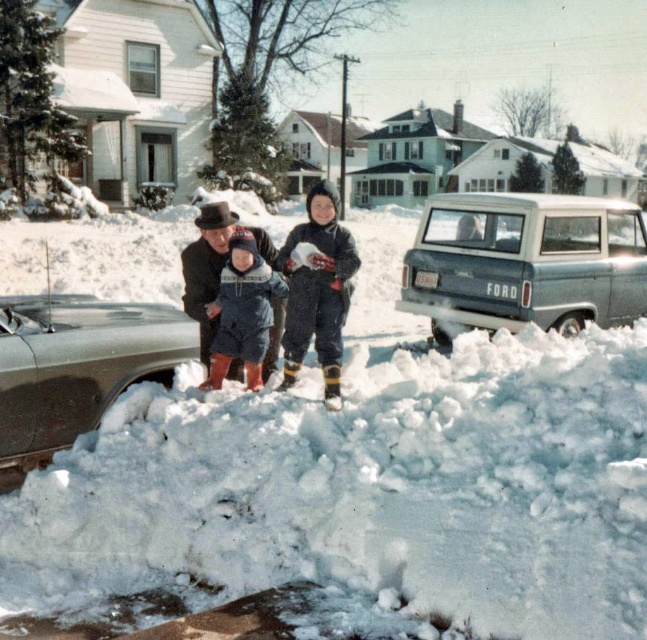
Can you confirm if silver metallic car at center is shorter than dark blue snowsuit at center?

Yes, silver metallic car at center is shorter than dark blue snowsuit at center.

Which is behind, point (133, 364) or point (311, 234)?

The point (133, 364) is more distant.

The image size is (647, 640). What do you see at coordinates (74, 369) in the screenshot?
I see `silver metallic car at center` at bounding box center [74, 369].

This screenshot has height=640, width=647. Find the location of `silver metallic car at center`. silver metallic car at center is located at coordinates (74, 369).

Does point (468, 474) come closer to viewer compared to point (543, 324)?

Yes, point (468, 474) is closer to viewer.

Is white fluffy snow at center to the right of metallic silver van at right from the viewer's perspective?

Incorrect, white fluffy snow at center is not on the right side of metallic silver van at right.

Does point (575, 448) come closer to viewer compared to point (516, 196)?

Yes, point (575, 448) is closer to viewer.

Image resolution: width=647 pixels, height=640 pixels. In order to click on white fluffy snow at center in this screenshot , I will do `click(362, 483)`.

Which of these two, white fluffy snow at center or dark blue snowsuit at center, stands taller?

white fluffy snow at center

Does white fluffy snow at center have a greater height compared to dark blue snowsuit at center?

Yes, white fluffy snow at center is taller than dark blue snowsuit at center.

This screenshot has height=640, width=647. What do you see at coordinates (362, 483) in the screenshot?
I see `white fluffy snow at center` at bounding box center [362, 483].

The width and height of the screenshot is (647, 640). I want to click on white fluffy snow at center, so click(362, 483).